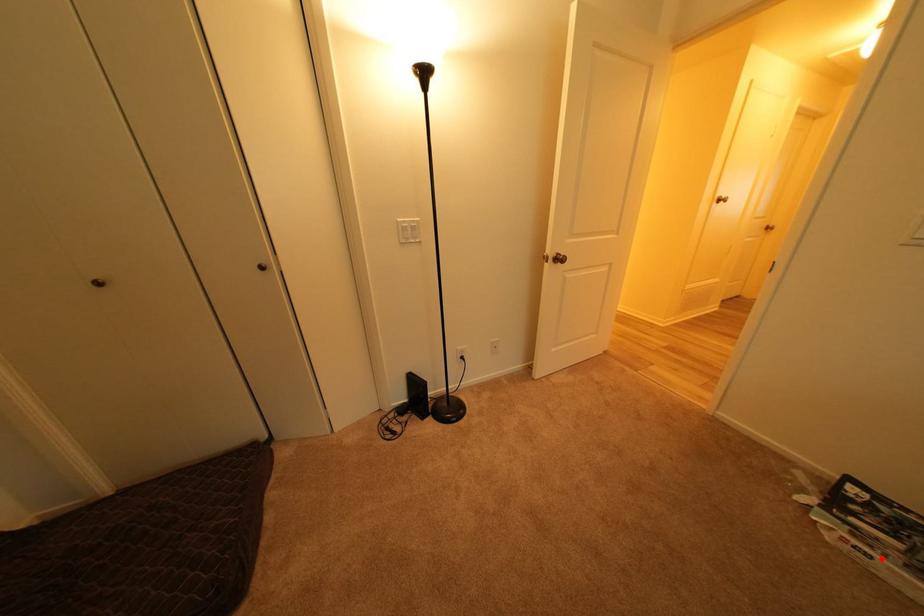
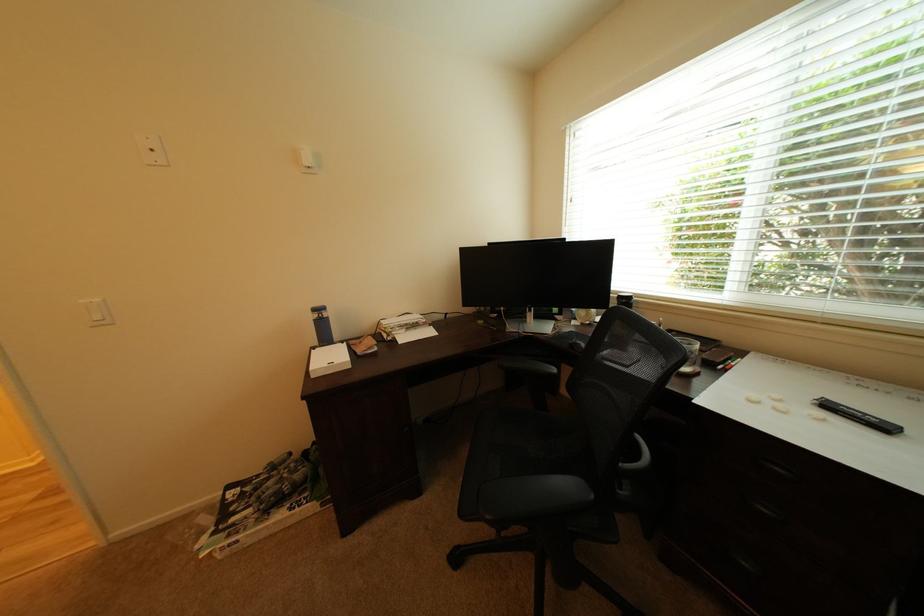
Locate, in the second image, the point that corresponds to the highlighted location in the first image.

(248, 543)